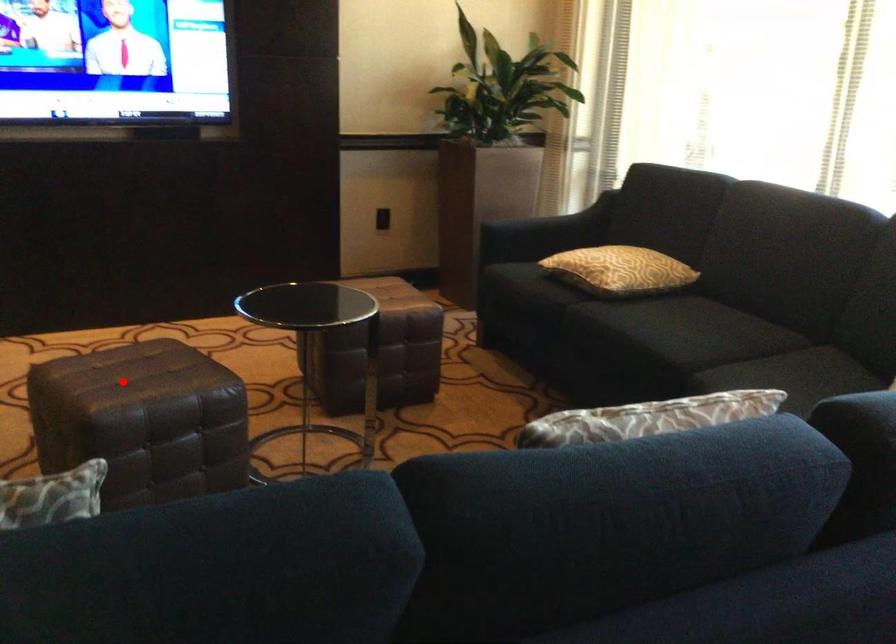
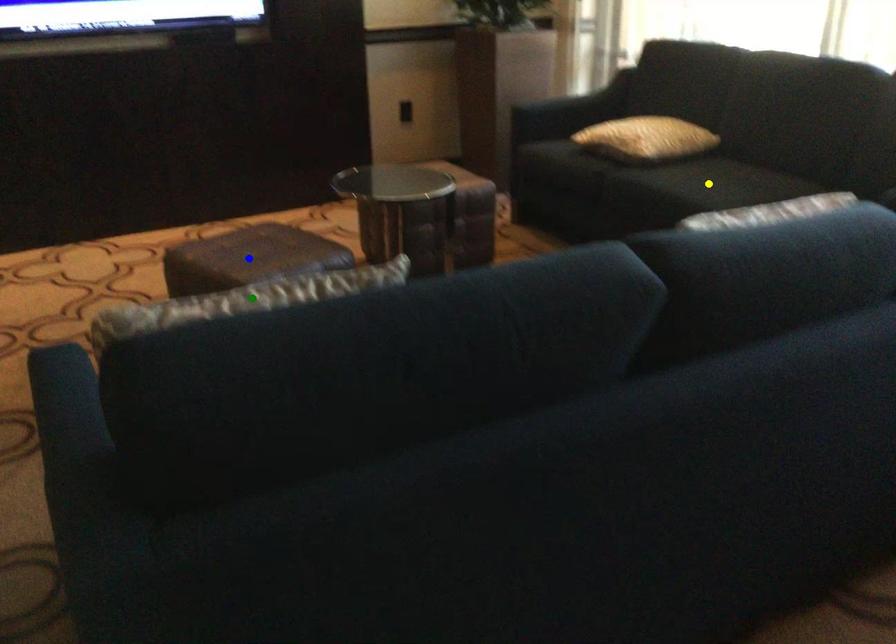
Question: I am providing you with two images of the same scene from different viewpoints. A red point is marked on the first image. You are given multiple points on the second image. Which point in image 2 is actually the same real-world point as the red point in image 1?

Choices:
 (A) yellow point
 (B) green point
 (C) blue point

Answer: (C)